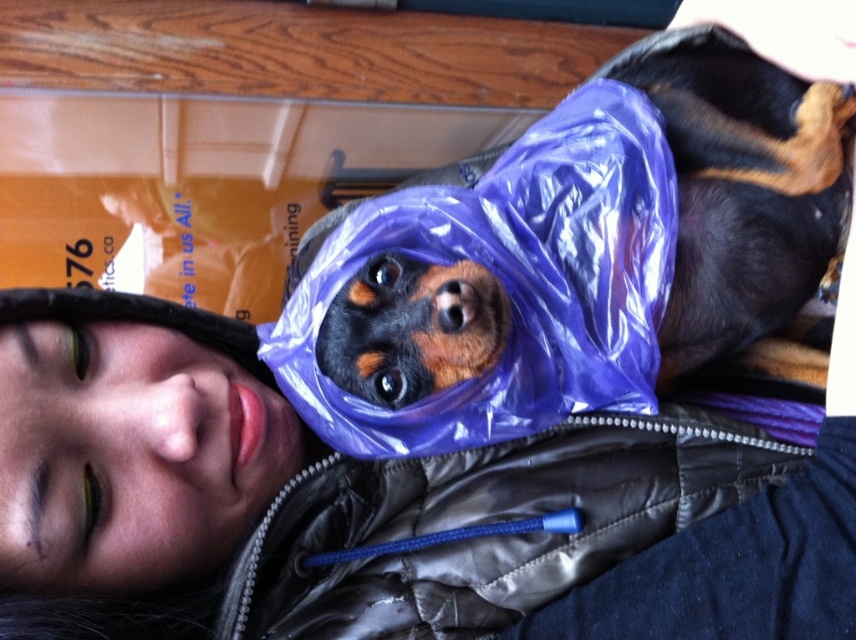
Question: Does matte black jacket at upper left have a lesser width compared to shiny purple plastic bag at center?

Choices:
 (A) no
 (B) yes

Answer: (A)

Question: Among these points, which one is farthest from the camera?

Choices:
 (A) (189, 308)
 (B) (693, 356)

Answer: (A)

Question: Can you confirm if matte black jacket at upper left is bigger than shiny purple plastic bag at center?

Choices:
 (A) yes
 (B) no

Answer: (B)

Question: Which point is farther from the camera taking this photo?

Choices:
 (A) (572, 477)
 (B) (616, 404)

Answer: (A)

Question: Is matte black jacket at upper left bigger than shiny purple plastic bag at center?

Choices:
 (A) no
 (B) yes

Answer: (A)